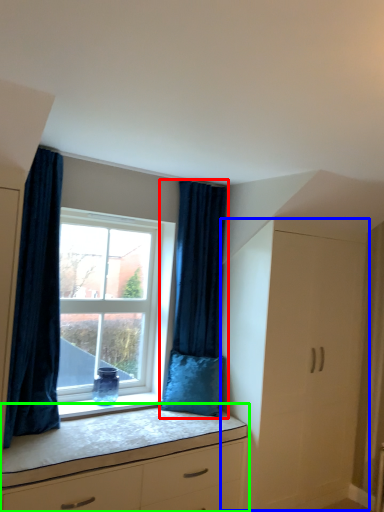
Question: Considering the real-world distances, which object is closest to curtain (highlighted by a red box)? file cabinet (highlighted by a blue box) or chest of drawers (highlighted by a green box).

Choices:
 (A) file cabinet
 (B) chest of drawers

Answer: (A)